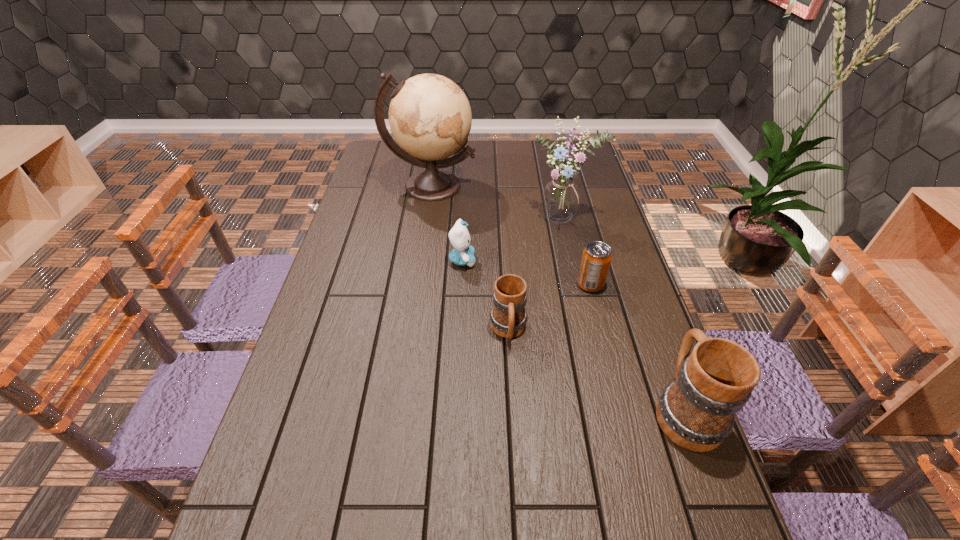
Where is `the second nearest object`? the second nearest object is located at coordinates (508, 317).

In order to click on the shorter mug in this screenshot , I will do `click(508, 317)`.

This screenshot has height=540, width=960. Find the location of `the taller mug`. the taller mug is located at coordinates 696,411.

Identify the location of the nearer mug. Image resolution: width=960 pixels, height=540 pixels. (696, 411).

At what (x,y) coordinates should I click in order to perform the action: click on globe. Please return your answer as a coordinate pair (x, y). Looking at the image, I should click on [430, 118].

Where is `the fourth nearest object`? The width and height of the screenshot is (960, 540). the fourth nearest object is located at coordinates 463,253.

I want to click on bouquet, so click(561, 197).

The width and height of the screenshot is (960, 540). Identify the location of soda can. (596, 258).

Locate an element on the screen. free location located on the side of the farther mug with the handle is located at coordinates (x=515, y=435).

The width and height of the screenshot is (960, 540). I want to click on vacant region located 0.130m on the side of the nearer mug with the handle, so click(x=655, y=328).